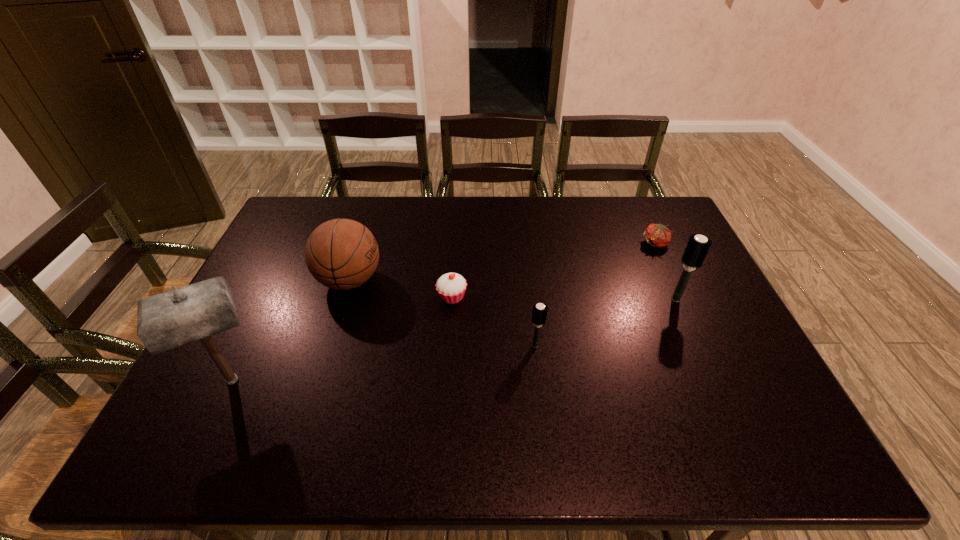
Where is `the tallest object`? Image resolution: width=960 pixels, height=540 pixels. the tallest object is located at coordinates (171, 319).

The height and width of the screenshot is (540, 960). Identify the location of free point located on the right of the left hairbrush. (619, 346).

You are a GUI agent. You are given a task and a screenshot of the screen. Output one action in this format:
    pyautogui.click(x=<x>, y=<y>)
    Task: Click on the vacant area located 0.330m on the back of the right hairbrush
    This screenshot has width=960, height=540.
    Given the screenshot: What is the action you would take?
    pyautogui.click(x=643, y=226)

Where is `free space located 0.260m on the side with brand label of the fifth object from right to left`? This screenshot has height=540, width=960. free space located 0.260m on the side with brand label of the fifth object from right to left is located at coordinates (468, 280).

What are the coordinates of `vacant space positioned 0.080m on the front of the shortest object` in the screenshot? It's located at (667, 269).

Identify the location of vacant area situated on the front of the second shortest object. The height and width of the screenshot is (540, 960). (448, 360).

This screenshot has width=960, height=540. In order to click on vacant space located on the back of the tallest object in this screenshot , I will do `click(270, 302)`.

Identify the location of object located in the far edge section of the desktop. (657, 235).

Where is `object situated at the near edge`? Image resolution: width=960 pixels, height=540 pixels. object situated at the near edge is located at coordinates (171, 319).

Where is `object located in the left edge section of the desktop`? The height and width of the screenshot is (540, 960). object located in the left edge section of the desktop is located at coordinates (171, 319).